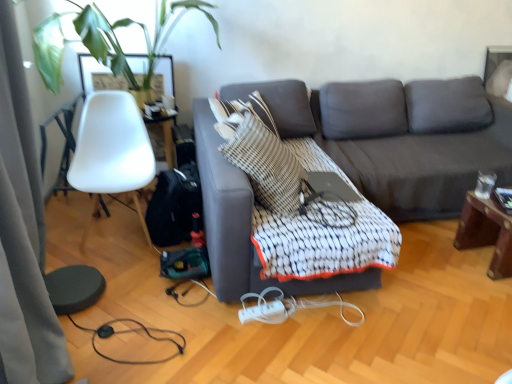
Find the location of a particular element. The image size is (512, 384). vacant position to the left of white plastic cable at lower center, which is counted as the second cable, starting from the left is located at coordinates (218, 341).